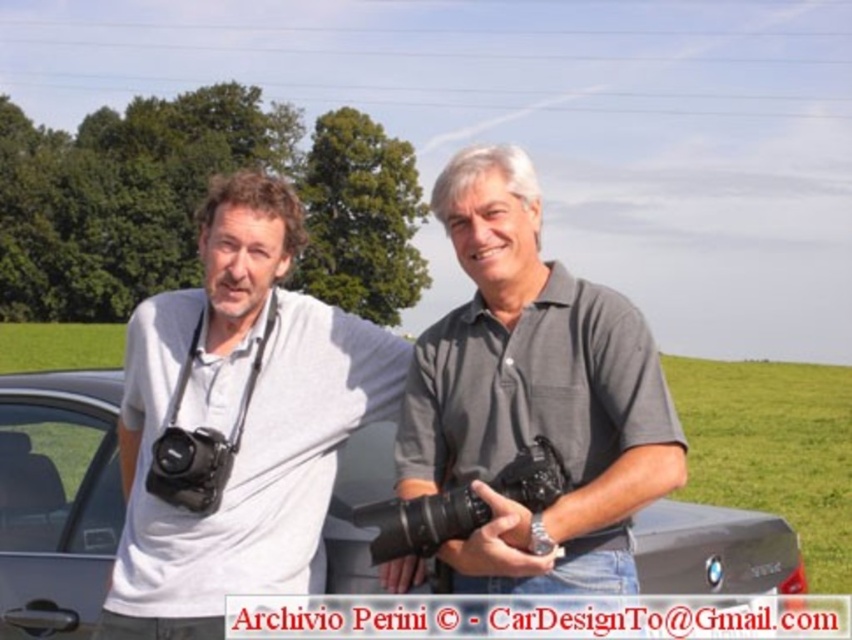
You are a photographer trying to set up your equipment. You see the matte gray shirt at left and the black matte camera at left in the scene. Which object is located more to the left?

The black matte camera at left is more to the left because the matte gray shirt at left is positioned on the right side of it.